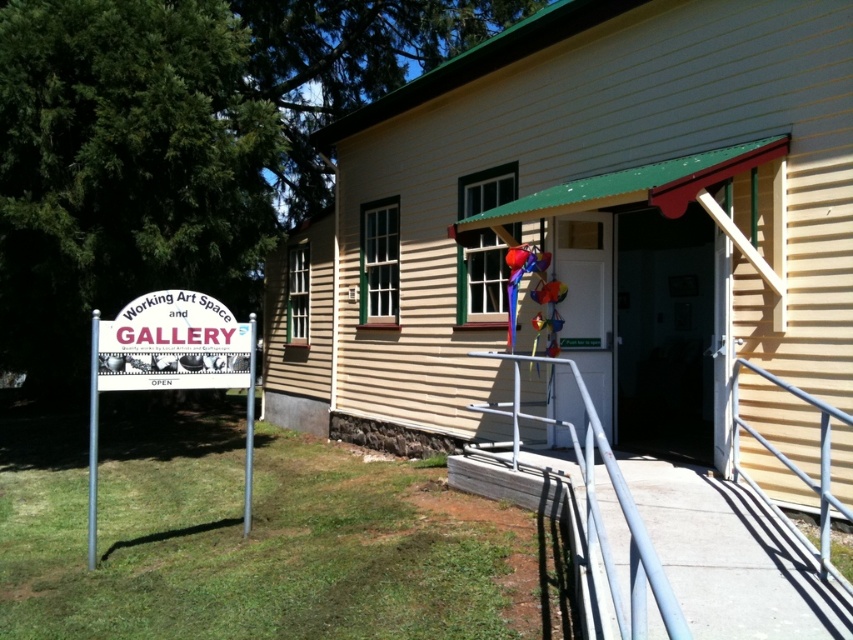
Question: Among these objects, which one is farthest from the camera?

Choices:
 (A) white plastic sign at lower left
 (B) white plastic sign at left
 (C) silver metallic handrail at lower right

Answer: (B)

Question: Is white plastic sign at left bigger than silver metallic handrail at lower right?

Choices:
 (A) no
 (B) yes

Answer: (A)

Question: Which object is the farthest from the silver metallic handrail at lower right?

Choices:
 (A) silver metallic handrail at center
 (B) white plastic sign at left
 (C) white plastic sign at lower left

Answer: (B)

Question: Is the position of white plastic sign at lower left less distant than that of white plastic sign at left?

Choices:
 (A) no
 (B) yes

Answer: (B)

Question: Which object is positioned closest to the silver metallic handrail at lower right?

Choices:
 (A) white plastic sign at lower left
 (B) white plastic sign at left
 (C) silver metallic handrail at center

Answer: (C)

Question: Is the position of white plastic sign at left more distant than that of silver metallic handrail at center?

Choices:
 (A) yes
 (B) no

Answer: (B)